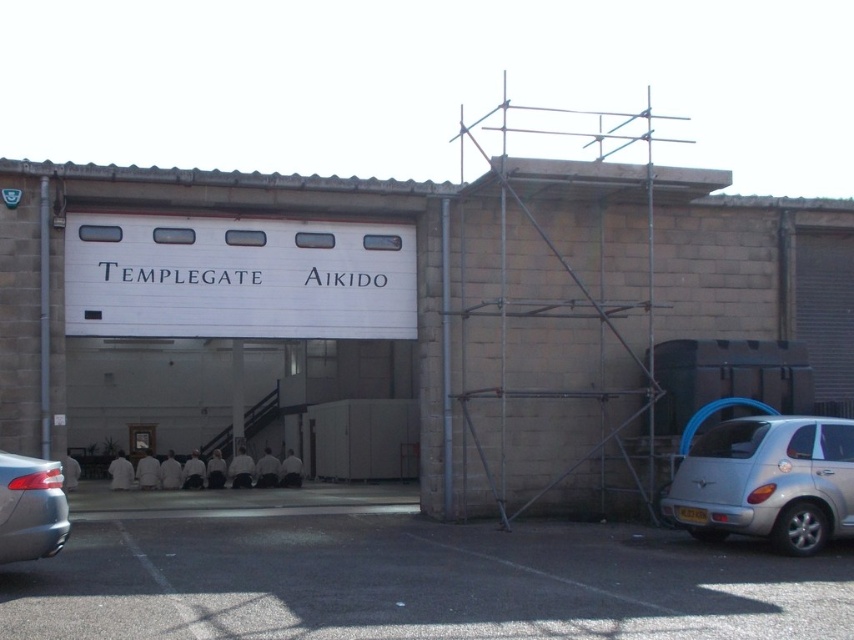
Question: Can you confirm if silver metallic car at lower right is positioned above metallic gray sedan at lower left?

Choices:
 (A) no
 (B) yes

Answer: (A)

Question: Which of the following is the closest to the observer?

Choices:
 (A) (224, 595)
 (B) (812, 444)
 (C) (22, 522)

Answer: (C)

Question: Among these points, which one is farthest from the camera?

Choices:
 (A) (769, 531)
 (B) (12, 506)
 (C) (109, 637)

Answer: (A)

Question: Does silver metallic car at lower right appear on the left side of metallic gray sedan at lower left?

Choices:
 (A) no
 (B) yes

Answer: (A)

Question: Which object appears farthest from the camera in this image?

Choices:
 (A) black asphalt parking lot at lower center
 (B) metallic gray sedan at lower left
 (C) silver metallic car at lower right

Answer: (C)

Question: Does black asphalt parking lot at lower center appear on the left side of silver metallic car at lower right?

Choices:
 (A) yes
 (B) no

Answer: (A)